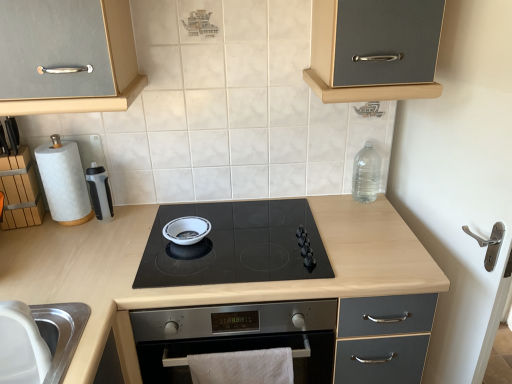
Question: Is point (203, 253) closer or farther from the camera than point (355, 160)?

Choices:
 (A) closer
 (B) farther

Answer: (A)

Question: From the image's perspective, is black glass cooktop at center located above or below clear plastic bottle at upper right?

Choices:
 (A) below
 (B) above

Answer: (A)

Question: Estimate the real-world distances between objects in this image. Which object is closer to the white cotton towel at lower center?

Choices:
 (A) stainless steel sink at lower left
 (B) light wood/black glass at center
 (C) white paper towel at left
 (D) white glossy bowl at center
 (E) wooden block at left

Answer: (B)

Question: Estimate the real-world distances between objects in this image. Which object is closer to the white paper towel at left?

Choices:
 (A) matte gray cabinet at upper right
 (B) clear plastic bottle at upper right
 (C) black glass cooktop at center
 (D) white cotton towel at lower center
 (E) white glossy bowl at center

Answer: (E)